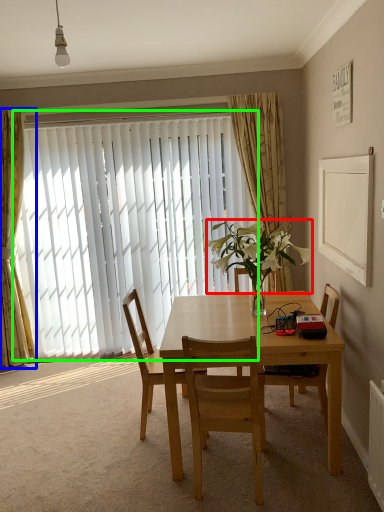
Question: Which object is the closest to the flower (highlighted by a red box)? Choose among these: curtain (highlighted by a blue box) or window (highlighted by a green box).

Choices:
 (A) curtain
 (B) window

Answer: (B)